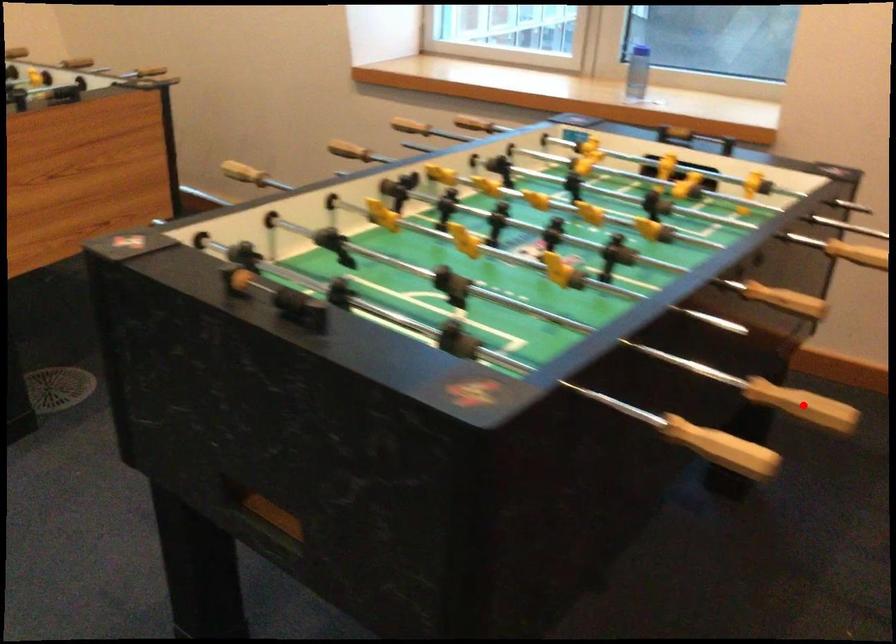
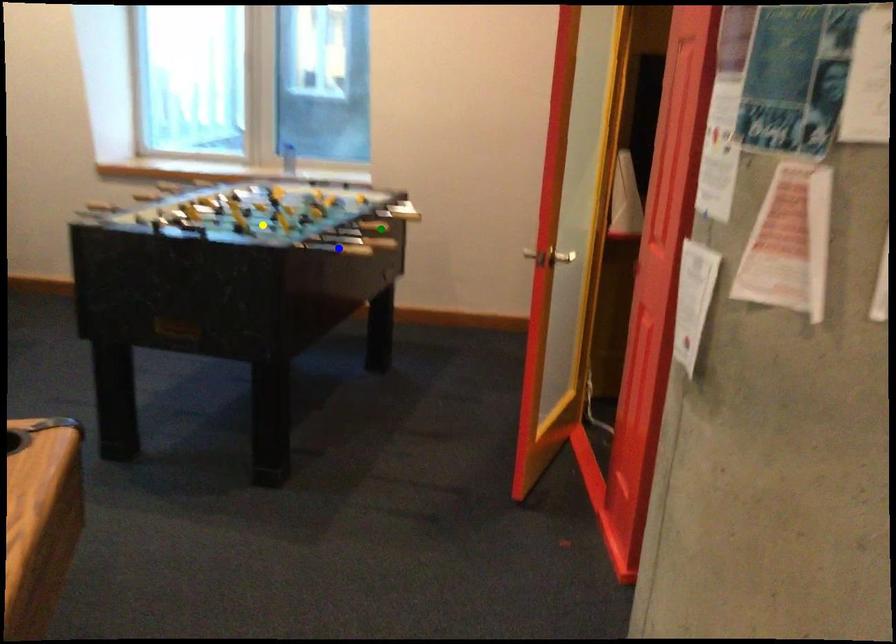
Question: I am providing you with two images of the same scene from different viewpoints. A red point is marked on the first image. You are given multiple points on the second image. In image 2, which mark is for the same physical point as the one in image 1?

Choices:
 (A) green point
 (B) yellow point
 (C) blue point

Answer: (A)